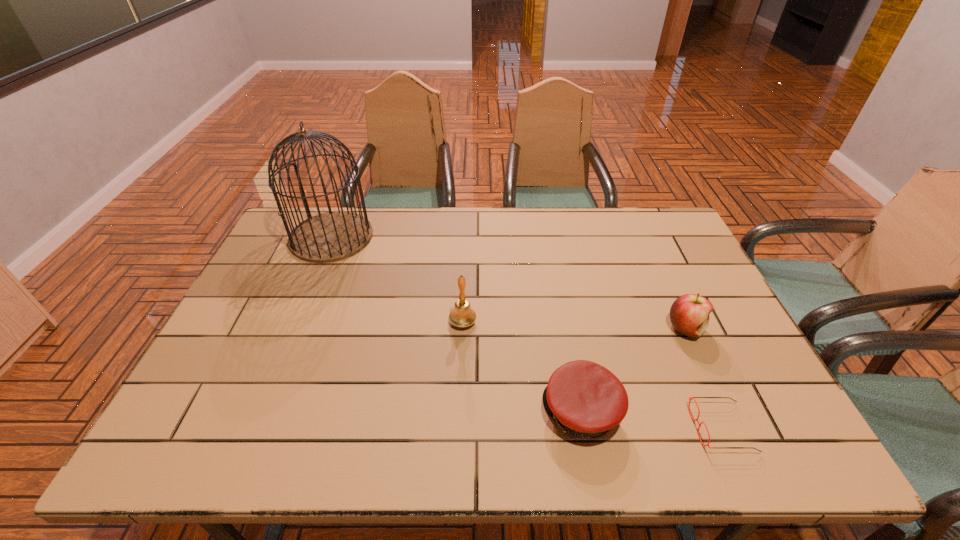
The width and height of the screenshot is (960, 540). In order to click on free space located 0.140m on the left of the third shortest object in this screenshot , I will do `click(614, 328)`.

At what (x,y) coordinates should I click in order to perform the action: click on vacant space located on the front-facing side of the cap. Please return your answer as a coordinate pair (x, y). Looking at the image, I should click on (402, 412).

Image resolution: width=960 pixels, height=540 pixels. What are the coordinates of `free space located on the front-facing side of the cap` in the screenshot? It's located at click(x=438, y=412).

Identify the location of vacant space situated on the front-facing side of the cap. This screenshot has height=540, width=960. (367, 412).

I want to click on free space located 0.190m on the front-facing side of the shortest object, so click(608, 428).

Where is `free point located 0.170m on the front-facing side of the shortest object`? The image size is (960, 540). free point located 0.170m on the front-facing side of the shortest object is located at coordinates (617, 428).

In order to click on blank space located 0.220m on the front-facing side of the shortest object in this screenshot , I will do `click(594, 428)`.

Find the location of a particular element. This screenshot has width=960, height=540. object present at the far edge is located at coordinates (333, 236).

Find the location of a particular element. The width and height of the screenshot is (960, 540). cap positioned at the near edge is located at coordinates (585, 399).

This screenshot has width=960, height=540. Find the location of `spectacles that is at the near edge`. spectacles that is at the near edge is located at coordinates (689, 397).